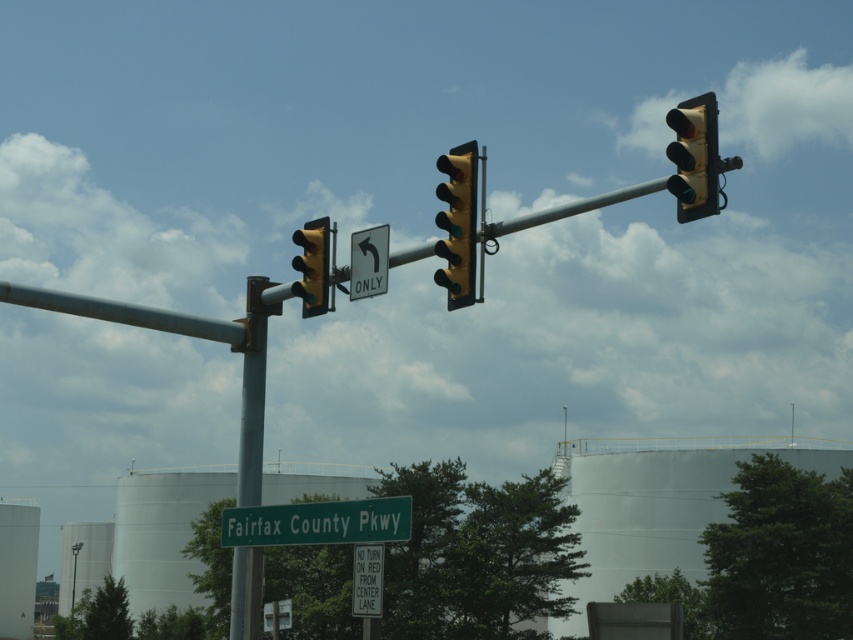
Which of these two, yellow matte traffic light at upper center or white paper sign at lower center, stands taller?

yellow matte traffic light at upper center is taller.

Who is positioned more to the left, yellow matte traffic light at upper center or white paper sign at lower center?

From the viewer's perspective, yellow matte traffic light at upper center appears more on the left side.

Between point (321, 250) and point (370, 614), which one is positioned behind?

Positioned behind is point (321, 250).

Find the location of `yellow matte traffic light at upper center`. yellow matte traffic light at upper center is located at coordinates (312, 266).

Between point (691, 132) and point (74, 598), which one is positioned in front?

Point (691, 132) is more forward.

Which is above, black plastic traffic light at upper right or metallic pole at upper center?

black plastic traffic light at upper right is above.

Who is more distant from viewer, (699, 106) or (73, 577)?

The point (73, 577) is more distant.

Where is `black plastic traffic light at upper right`? black plastic traffic light at upper right is located at coordinates (694, 156).

Who is higher up, metallic pole at center or metallic pole at upper center?

metallic pole at center is above.

At what (x,y) coordinates should I click in order to perform the action: click on metallic pole at center. Please return your answer as a coordinate pair (x, y). The height and width of the screenshot is (640, 853). Looking at the image, I should click on (253, 388).